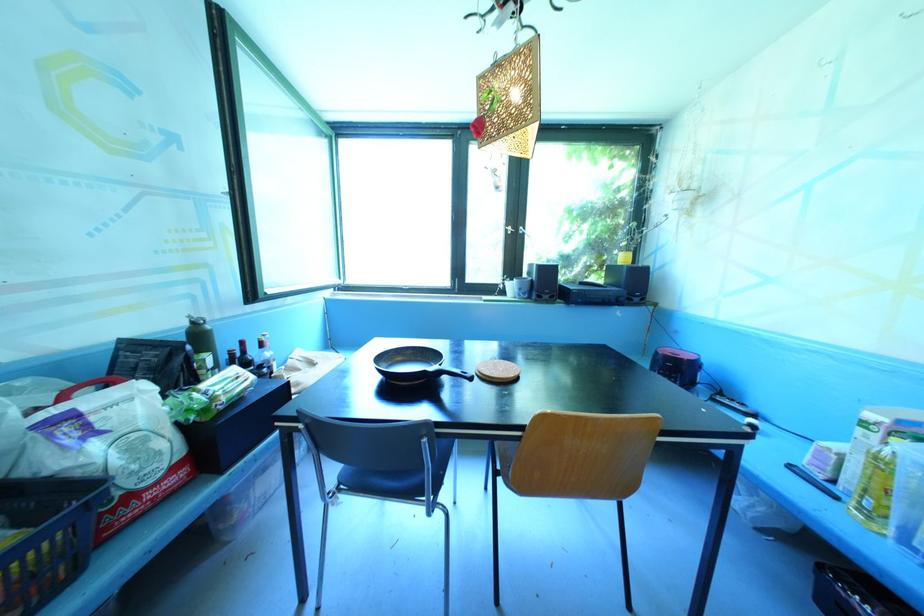
Find where to lift the green water bottle. Please return your answer as a coordinate pair (x, y).

(201, 342)